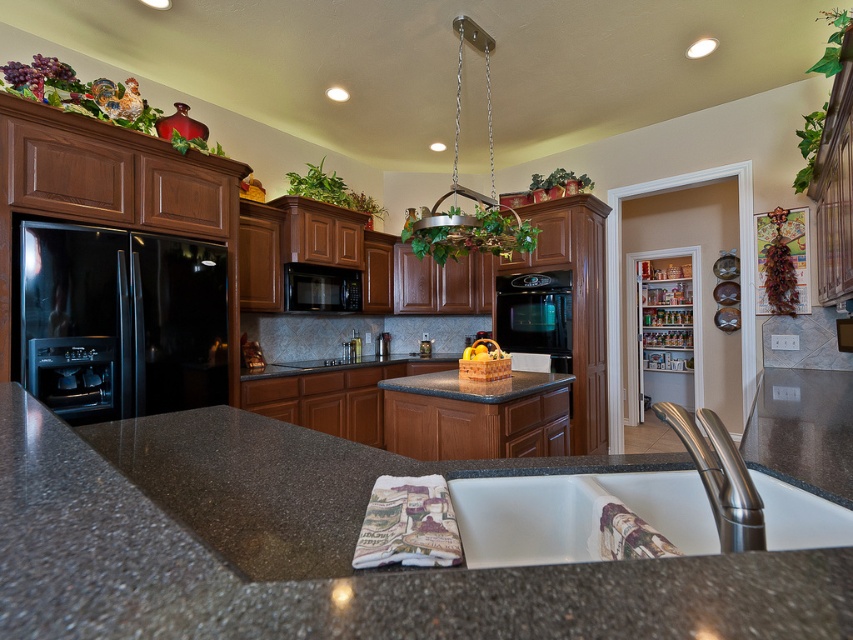
What is the 2D coordinate of the granite at center?

The granite at center is located at point (322, 547).

Please look at the kitchen scene. There is a point marked at coordinates (x=120, y=321). Which object in the scene does this point correspond to?

The point at coordinates (x=120, y=321) corresponds to the black stainless steel refrigerator at left.

You are a delivery person who needs to place a new microwave oven in the kitchen. The microwave requires a space that is at least 1 meter wide. Based on the scene, can you determine if the area near the black stainless steel refrigerator at left has enough width for the microwave?

The position of black stainless steel refrigerator at left is at point (120, 321). However, without knowing the dimensions or spacing around it, it is impossible to determine if the area has enough width for the microwave.